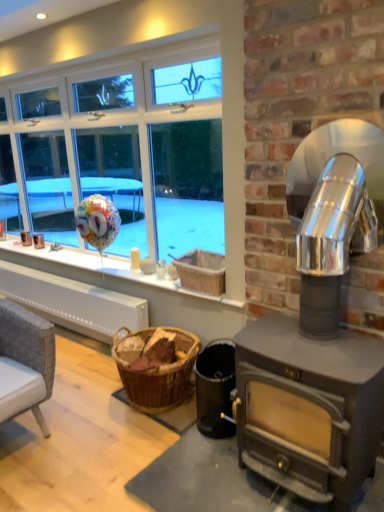
Question: Considering the relative positions of black matte wood stove at lower right and wooden basket at center in the image provided, is black matte wood stove at lower right to the left of wooden basket at center from the viewer's perspective?

Choices:
 (A) yes
 (B) no

Answer: (B)

Question: Considering the relative sizes of black matte wood stove at lower right and wooden basket at center in the image provided, is black matte wood stove at lower right thinner than wooden basket at center?

Choices:
 (A) yes
 (B) no

Answer: (A)

Question: Is black matte wood stove at lower right touching wooden basket at center?

Choices:
 (A) yes
 (B) no

Answer: (B)

Question: Could you tell me if black matte wood stove at lower right is turned towards wooden basket at center?

Choices:
 (A) yes
 (B) no

Answer: (B)

Question: Is the position of black matte wood stove at lower right more distant than that of wooden basket at center?

Choices:
 (A) no
 (B) yes

Answer: (A)

Question: Does black matte wood stove at lower right have a smaller size compared to wooden basket at center?

Choices:
 (A) yes
 (B) no

Answer: (B)

Question: Is black matte wood stove at lower right not close to metallic silver fireplace at right?

Choices:
 (A) no
 (B) yes

Answer: (A)

Question: From a real-world perspective, is black matte wood stove at lower right on top of metallic silver fireplace at right?

Choices:
 (A) yes
 (B) no

Answer: (B)

Question: Is black matte wood stove at lower right thinner than metallic silver fireplace at right?

Choices:
 (A) yes
 (B) no

Answer: (A)

Question: Can metallic silver fireplace at right be found inside black matte wood stove at lower right?

Choices:
 (A) yes
 (B) no

Answer: (B)

Question: Does black matte wood stove at lower right lie in front of metallic silver fireplace at right?

Choices:
 (A) no
 (B) yes

Answer: (A)

Question: From the image's perspective, is black matte wood stove at lower right beneath metallic silver fireplace at right?

Choices:
 (A) no
 (B) yes

Answer: (B)

Question: Can you confirm if wooden basket at center is wider than black matte wood stove at lower right?

Choices:
 (A) yes
 (B) no

Answer: (A)